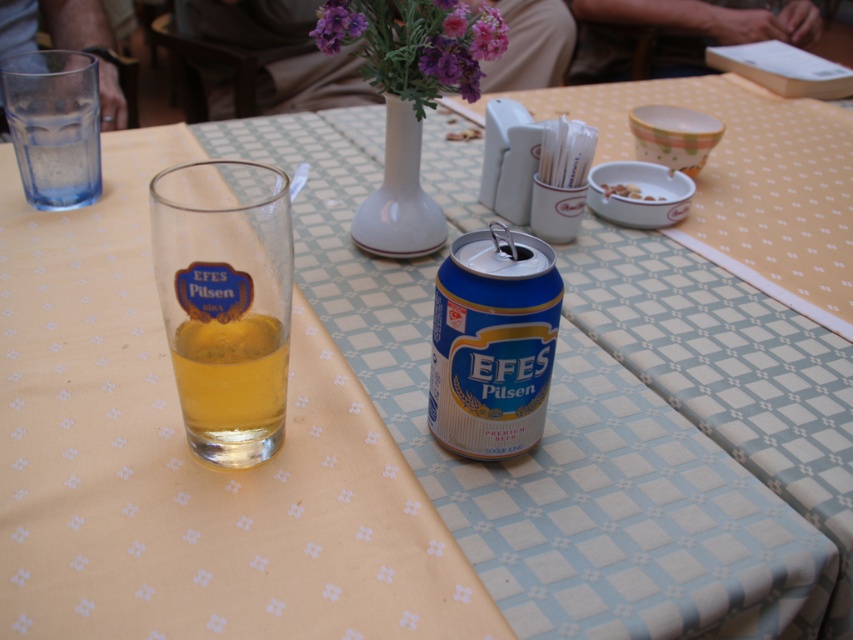
Is translucent glass at left positioned before purple matte vase at upper center?

Yes, it is.

From the picture: Is translucent glass at left to the left of purple matte vase at upper center from the viewer's perspective?

Yes, translucent glass at left is to the left of purple matte vase at upper center.

I want to click on translucent glass at left, so click(225, 301).

Between purple matte vase at upper center and white crumbly food at center, which one appears on the right side from the viewer's perspective?

white crumbly food at center is more to the right.

Who is shorter, purple matte vase at upper center or white crumbly food at center?

Standing shorter between the two is white crumbly food at center.

Which is behind, point (489, 20) or point (648, 195)?

Point (648, 195)

Locate an element on the screen. purple matte vase at upper center is located at coordinates (415, 44).

Between transparent glass at upper left and white crumbly food at center, which one appears on the left side from the viewer's perspective?

From the viewer's perspective, transparent glass at upper left appears more on the left side.

Between transparent glass at upper left and white crumbly food at center, which one has less height?

Standing shorter between the two is white crumbly food at center.

Describe the element at coordinates (57, 154) in the screenshot. I see `transparent glass at upper left` at that location.

At what (x,y) coordinates should I click in order to perform the action: click on transparent glass at upper left. Please return your answer as a coordinate pair (x, y). The width and height of the screenshot is (853, 640). Looking at the image, I should click on (57, 154).